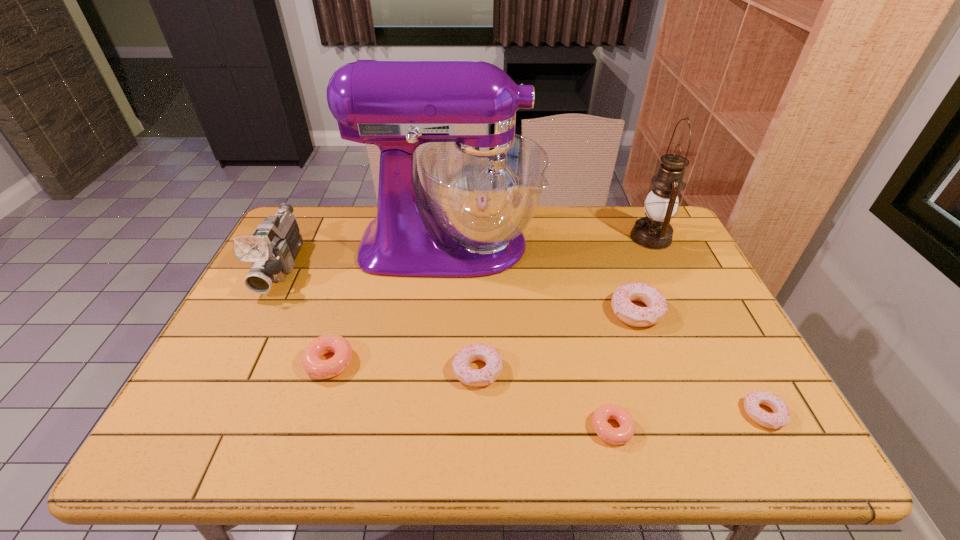
Where is `white doughnut that stands as the closest to the leftmost white doughnut`? The image size is (960, 540). white doughnut that stands as the closest to the leftmost white doughnut is located at coordinates (631, 314).

Identify which white doughnut is located as the third nearest to the bigger pink doughnut. Please provide its 2D coordinates. Your answer should be formatted as a tuple, i.e. [(x, y)], where the tuple contains the x and y coordinates of a point satisfying the conditions above.

[(781, 416)]

Find the location of a particular element. The width and height of the screenshot is (960, 540). vacant area that satisfies the following two spatial constraints: 1. at the bowl opening of the tallest object; 2. on the back side of the rightmost white doughnut is located at coordinates (436, 414).

What are the coordinates of `vacant space that satisfies the following two spatial constraints: 1. at the bowl opening of the mixer; 2. on the right side of the biggest white doughnut` in the screenshot? It's located at (444, 312).

The image size is (960, 540). I want to click on free region that satisfies the following two spatial constraints: 1. on the front-facing side of the third tallest object; 2. on the right side of the rightmost doughnut, so click(x=207, y=414).

Find the location of a particular element. The width and height of the screenshot is (960, 540). vacant point that satisfies the following two spatial constraints: 1. at the bowl opening of the mixer; 2. on the back side of the second biggest white doughnut is located at coordinates (440, 370).

Where is `free location that satisfies the following two spatial constraints: 1. at the bowl opening of the purple mixer; 2. on the left side of the nearest white doughnut`? The height and width of the screenshot is (540, 960). free location that satisfies the following two spatial constraints: 1. at the bowl opening of the purple mixer; 2. on the left side of the nearest white doughnut is located at coordinates (436, 414).

I want to click on blank space that satisfies the following two spatial constraints: 1. at the bowl opening of the purple mixer; 2. on the left side of the second smallest white doughnut, so pos(440,370).